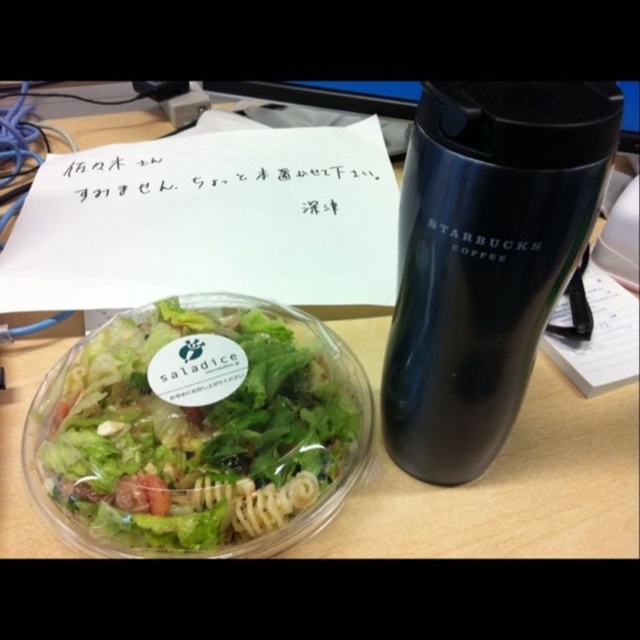
Is black matte thermos at right positioned before wooden table at center?

Yes.

Does black matte thermos at right appear under wooden table at center?

Actually, black matte thermos at right is above wooden table at center.

Is point (413, 435) more distant than point (28, 547)?

Yes, point (413, 435) is behind point (28, 547).

You are a GUI agent. You are given a task and a screenshot of the screen. Output one action in this format:
    pyautogui.click(x=<x>, y=<y>)
    Task: Click on the black matte thermos at right
    The image size is (640, 640).
    Given the screenshot: What is the action you would take?
    pyautogui.click(x=484, y=257)

Does point (461, 408) come closer to viewer compared to point (451, 225)?

No.

Is black matte thermos at right taller than black matte starbucks coffee cup at right?

Yes, black matte thermos at right is taller than black matte starbucks coffee cup at right.

Is point (496, 291) closer to viewer compared to point (492, 257)?

That is False.

Identify the location of black matte thermos at right. (484, 257).

Does translucent plastic salad bowl at lower left have a greater height compared to black matte starbucks coffee cup at right?

Yes, translucent plastic salad bowl at lower left is taller than black matte starbucks coffee cup at right.

Where is `translucent plastic salad bowl at lower left`? The height and width of the screenshot is (640, 640). translucent plastic salad bowl at lower left is located at coordinates (198, 429).